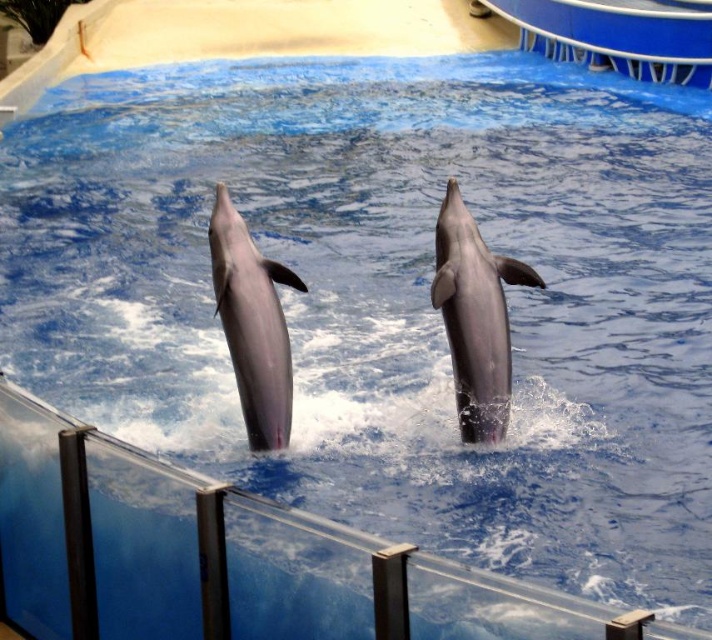
You are a marine trainer standing at the edge of the pool. You need to throw a fish to both the gray smooth dolphin at center and the pink smooth dolphin at center. Considering their positions, can you throw the fish to both dolphins with one throw?

The gray smooth dolphin at center and pink smooth dolphin at center are 1.40 meters apart. Since they are positioned close to each other, you can throw the fish to both dolphins with one throw as they are within a reasonable distance.

In the scene shown: You are a marine biologist observing the gray smooth dolphin at center in the pool. What are the coordinates of the dolphin?

The coordinates of the gray smooth dolphin at center are at point (476, 317).

You are a marine trainer observing two dolphins in the pool. You notice the gray smooth dolphin at center and the pink smooth dolphin at center. Which dolphin is located to the right of the other?

The gray smooth dolphin at center is positioned on the right side of the pink smooth dolphin at center.